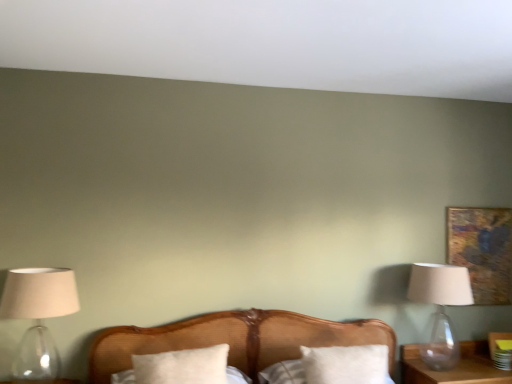
Question: Is white soft pillow at center, the second pillow positioned from the left, completely or partially outside of gold textured painting at upper right?

Choices:
 (A) no
 (B) yes

Answer: (B)

Question: Considering the relative sizes of white soft pillow at center, the second pillow positioned from the left, and gold textured painting at upper right in the image provided, is white soft pillow at center, the second pillow positioned from the left, taller than gold textured painting at upper right?

Choices:
 (A) yes
 (B) no

Answer: (B)

Question: Does white soft pillow at center, the second pillow positioned from the left, lie in front of gold textured painting at upper right?

Choices:
 (A) yes
 (B) no

Answer: (A)

Question: Can you confirm if white soft pillow at center, the 1th pillow viewed from the right, is bigger than gold textured painting at upper right?

Choices:
 (A) yes
 (B) no

Answer: (A)

Question: Is white soft pillow at center, the 1th pillow viewed from the right, shorter than gold textured painting at upper right?

Choices:
 (A) yes
 (B) no

Answer: (A)

Question: In the image, is wooden bed at center positioned in front of or behind white soft pillow at center, which is the first pillow in left-to-right order?

Choices:
 (A) front
 (B) behind

Answer: (A)

Question: In terms of width, does wooden bed at center look wider or thinner when compared to white soft pillow at center, which appears as the 2th pillow when viewed from the right?

Choices:
 (A) wide
 (B) thin

Answer: (A)

Question: Would you say wooden bed at center is to the left or to the right of white soft pillow at center, which appears as the 2th pillow when viewed from the right, in the picture?

Choices:
 (A) left
 (B) right

Answer: (B)

Question: From the image's perspective, relative to white soft pillow at center, which appears as the 2th pillow when viewed from the right, is wooden bed at center above or below?

Choices:
 (A) below
 (B) above

Answer: (B)

Question: Considering the positions of translucent glass lampshade at left, the 2th lamp positioned from the back, and gold textured painting at upper right in the image, is translucent glass lampshade at left, the 2th lamp positioned from the back, taller or shorter than gold textured painting at upper right?

Choices:
 (A) tall
 (B) short

Answer: (B)

Question: From the image's perspective, relative to gold textured painting at upper right, is translucent glass lampshade at left, the 2th lamp positioned from the back, above or below?

Choices:
 (A) above
 (B) below

Answer: (B)

Question: Considering the positions of translucent glass lampshade at left, the 1th lamp positioned from the front, and gold textured painting at upper right in the image, is translucent glass lampshade at left, the 1th lamp positioned from the front, bigger or smaller than gold textured painting at upper right?

Choices:
 (A) small
 (B) big

Answer: (B)

Question: In the image, is translucent glass lampshade at left, the 1th lamp positioned from the front, positioned in front of or behind gold textured painting at upper right?

Choices:
 (A) behind
 (B) front

Answer: (B)

Question: Does point (297, 332) appear closer or farther from the camera than point (61, 284)?

Choices:
 (A) farther
 (B) closer

Answer: (A)

Question: Considering their positions, is wooden bed at center located in front of or behind translucent glass lampshade at left, the 1th lamp positioned from the front?

Choices:
 (A) front
 (B) behind

Answer: (A)